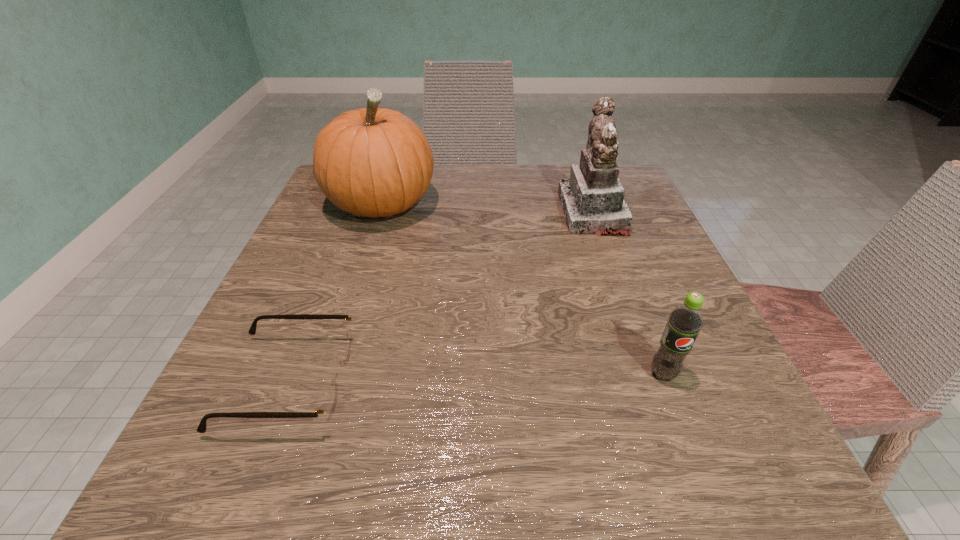
Locate an element on the screen. This screenshot has width=960, height=540. free space at the far edge of the desktop is located at coordinates (433, 186).

In the image, there is a desktop. In order to click on free space at the near edge in this screenshot , I will do [402, 472].

The height and width of the screenshot is (540, 960). I want to click on free region at the left edge of the desktop, so click(317, 281).

In the image, there is a desktop. Identify the location of vacant space at the near left corner. The image size is (960, 540). (276, 429).

The image size is (960, 540). In order to click on free area in between the pumpkin and the spectacles in this screenshot , I will do `click(336, 293)`.

The image size is (960, 540). Find the location of `free spot between the pumpkin and the soda`. free spot between the pumpkin and the soda is located at coordinates (522, 289).

You are a GUI agent. You are given a task and a screenshot of the screen. Output one action in this format:
    pyautogui.click(x=<x>, y=<y>)
    Task: Click on the free area in between the spectacles and the pumpkin
    
    Given the screenshot: What is the action you would take?
    [x=336, y=293]

In order to click on free spot between the shortest object and the figurine in this screenshot , I will do `click(442, 298)`.

The width and height of the screenshot is (960, 540). In order to click on vacant point located between the pumpkin and the spectacles in this screenshot , I will do `click(336, 293)`.

Locate an element on the screen. vacant space that's between the figurine and the pumpkin is located at coordinates (487, 208).